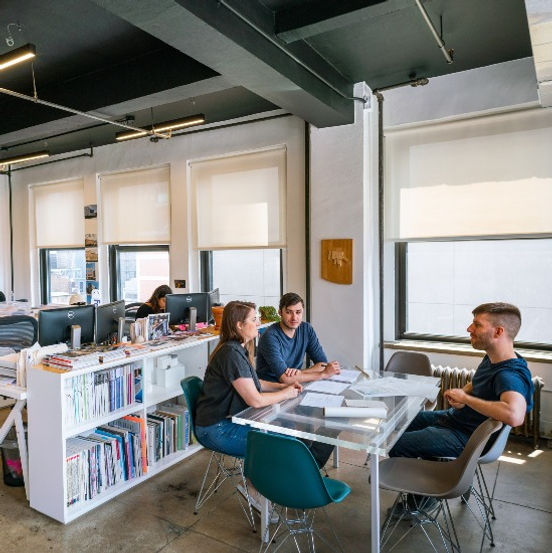
At what (x,y) coordinates should I click in order to perform the action: click on wood floor. Please return your answer as a coordinate pair (x, y). Image resolution: width=552 pixels, height=553 pixels. Looking at the image, I should click on (162, 519), (530, 479), (527, 526).